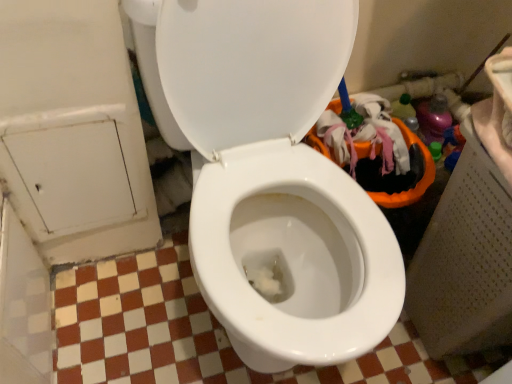
Question: From a real-world perspective, relative to white glossy toilet at center, is white powder at center vertically above or below?

Choices:
 (A) above
 (B) below

Answer: (B)

Question: Is white powder at center spatially inside white glossy toilet at center, or outside of it?

Choices:
 (A) inside
 (B) outside

Answer: (A)

Question: Is white powder at center bigger or smaller than white glossy toilet at center?

Choices:
 (A) big
 (B) small

Answer: (B)

Question: Considering the positions of white glossy toilet at center and white powder at center in the image, is white glossy toilet at center taller or shorter than white powder at center?

Choices:
 (A) short
 (B) tall

Answer: (B)

Question: Considering the relative positions of white glossy toilet at center and white powder at center in the image provided, is white glossy toilet at center to the left or to the right of white powder at center?

Choices:
 (A) left
 (B) right

Answer: (A)

Question: Choose the correct answer: Is white glossy toilet at center inside white powder at center or outside it?

Choices:
 (A) inside
 (B) outside

Answer: (B)

Question: In terms of size, does white glossy toilet at center appear bigger or smaller than white powder at center?

Choices:
 (A) small
 (B) big

Answer: (B)